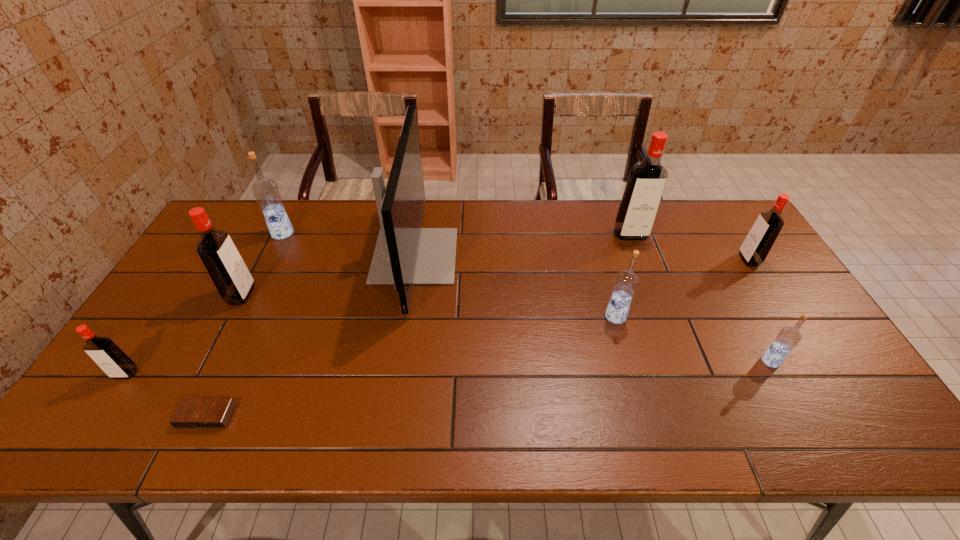
Where is `computer monitor`? The height and width of the screenshot is (540, 960). computer monitor is located at coordinates (405, 254).

Image resolution: width=960 pixels, height=540 pixels. I want to click on the third vodka from right to left, so click(x=647, y=179).

Find the location of a particular element. the third red vodka from left to right is located at coordinates (647, 179).

Locate an element on the screen. Image resolution: width=960 pixels, height=540 pixels. the leftmost blue vodka is located at coordinates (266, 192).

Where is `the farthest blue vodka`? The width and height of the screenshot is (960, 540). the farthest blue vodka is located at coordinates (266, 192).

Identify the location of the fourth farthest vodka. This screenshot has width=960, height=540. (230, 275).

The image size is (960, 540). Identify the location of the third farthest red vodka. (230, 275).

At what (x,y) coordinates should I click in order to perform the action: click on the third farthest vodka. Please return your answer as a coordinate pair (x, y). The image size is (960, 540). Looking at the image, I should click on (756, 246).

Locate an element on the screen. Image resolution: width=960 pixels, height=540 pixels. the rightmost object is located at coordinates (756, 246).

At what (x,y) coordinates should I click in order to perform the action: click on the second blue vodka from right to left. Please return your answer as a coordinate pair (x, y). Looking at the image, I should click on (626, 282).